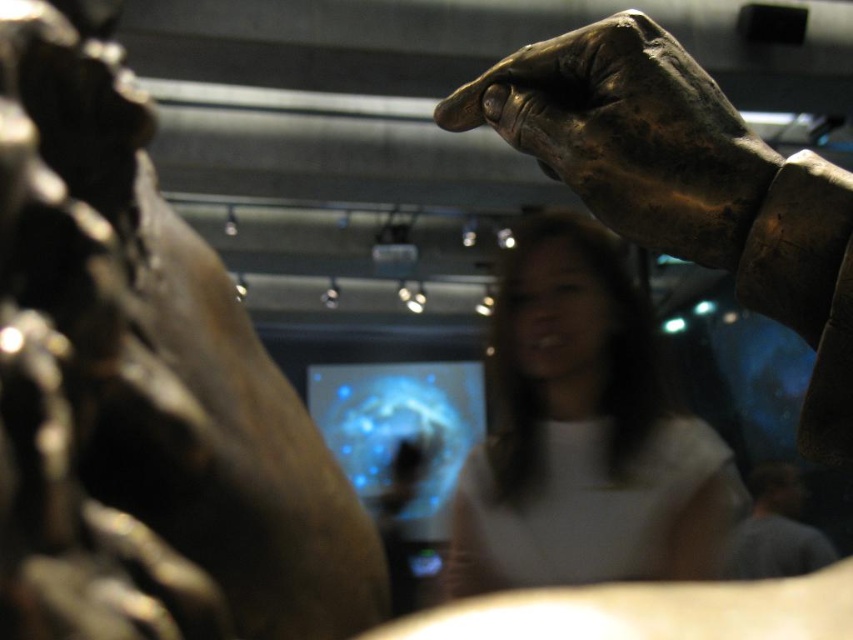
Is shiny bronze statue at upper left taller than bronze textured hand at upper right?

Correct, shiny bronze statue at upper left is much taller as bronze textured hand at upper right.

Is shiny bronze statue at upper left shorter than bronze textured hand at upper right?

No, shiny bronze statue at upper left is not shorter than bronze textured hand at upper right.

Measure the distance between point (76, 248) and camera.

The distance of point (76, 248) from camera is 16.77 centimeters.

The image size is (853, 640). I want to click on shiny bronze statue at upper left, so click(x=143, y=388).

Between white matte shirt at center and bronze textured hand at upper right, which one is positioned higher?

bronze textured hand at upper right is higher up.

Between white matte shirt at center and bronze textured hand at upper right, which one has more height?

With more height is white matte shirt at center.

Between point (712, 561) and point (546, 51), which one is positioned behind?

The point (712, 561) is behind.

The width and height of the screenshot is (853, 640). In order to click on white matte shirt at center in this screenshot , I will do `click(583, 435)`.

Can you confirm if shiny bronze statue at upper left is positioned below white matte shirt at center?

Actually, shiny bronze statue at upper left is above white matte shirt at center.

Locate an element on the screen. shiny bronze statue at upper left is located at coordinates (143, 388).